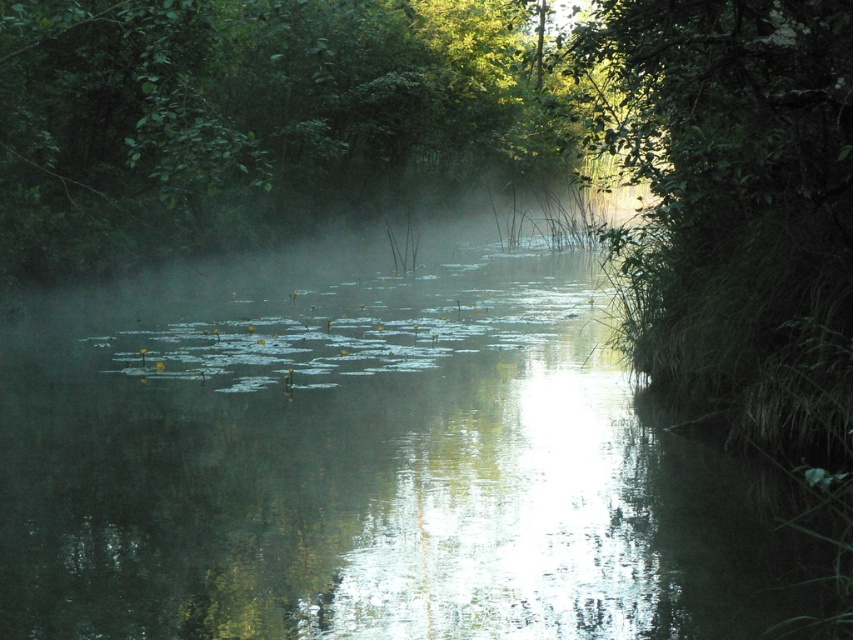
Question: Which point is farther to the camera?

Choices:
 (A) (366, 52)
 (B) (285, 388)

Answer: (A)

Question: Observing the image, what is the correct spatial positioning of green reflective water at center in reference to green leafy tree at upper center?

Choices:
 (A) below
 (B) above

Answer: (A)

Question: Among these objects, which one is nearest to the camera?

Choices:
 (A) green leafy tree at upper center
 (B) green reflective water at center

Answer: (B)

Question: Is green reflective water at center below green leafy tree at upper center?

Choices:
 (A) yes
 (B) no

Answer: (A)

Question: Can you confirm if green reflective water at center is wider than green leafy tree at upper center?

Choices:
 (A) no
 (B) yes

Answer: (A)